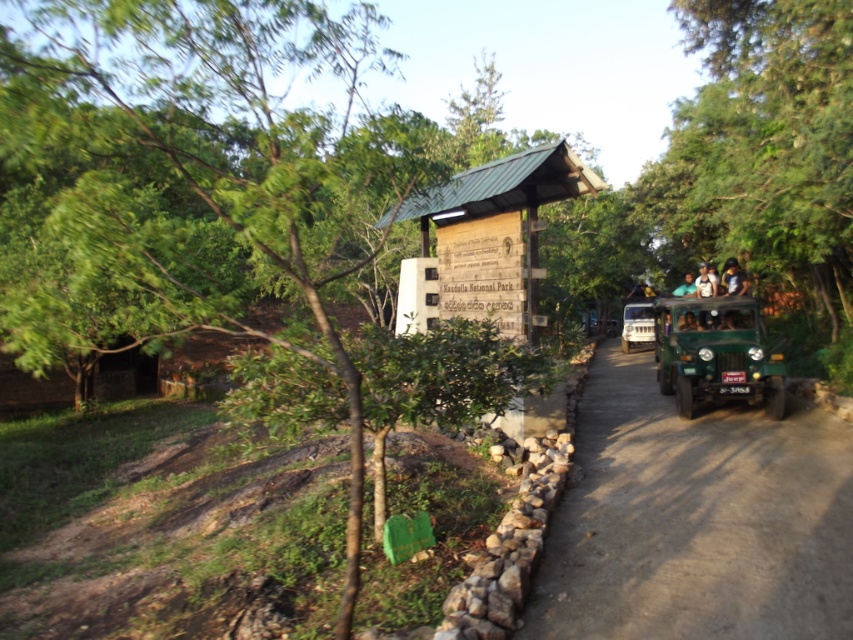
You are a visitor approaching the entrance of Kazuwa National Park. You see the wooden sign at center and the green fabric person at center. Which object is closer to you as you approach?

The wooden sign at center is closer to you because it is in front of the green fabric person at center.